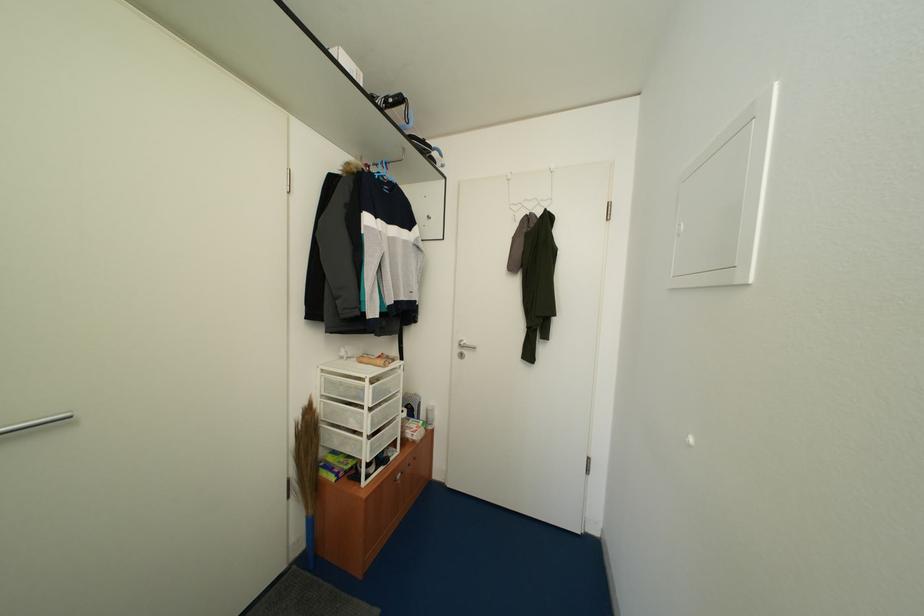
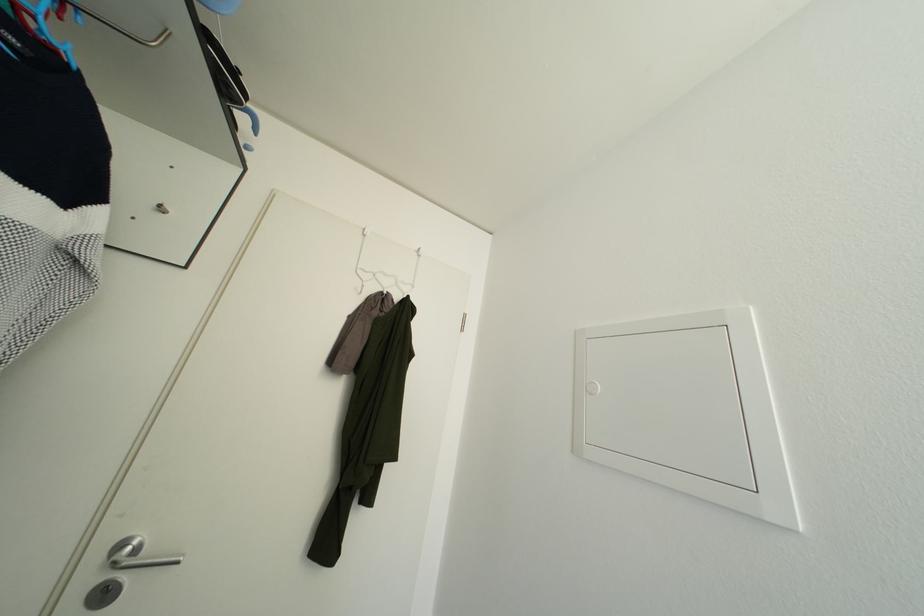
Consider the image. How did the camera likely rotate?

The camera rotated toward right-up.